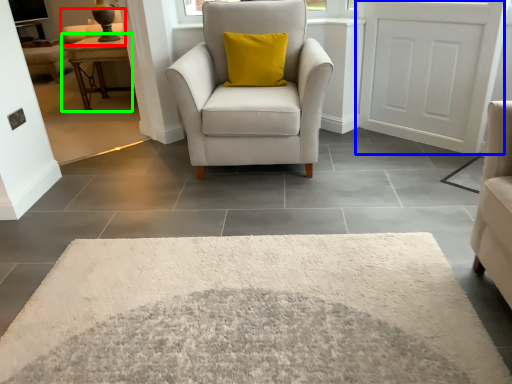
Question: Considering the real-world distances, which object is farthest from couch (highlighted by a red box)? door (highlighted by a blue box) or table (highlighted by a green box)?

Choices:
 (A) door
 (B) table

Answer: (A)